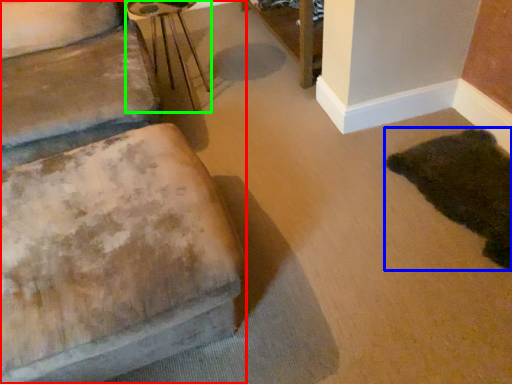
Question: Which object is the farthest from furniture (highlighted by a red box)? Choose among these: animal (highlighted by a blue box) or side table (highlighted by a green box).

Choices:
 (A) animal
 (B) side table

Answer: (B)